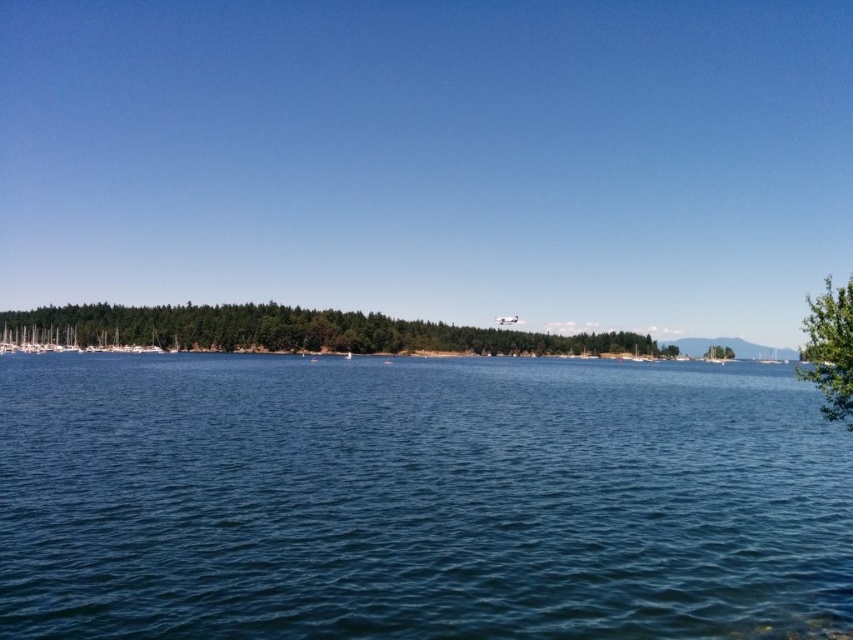
Locate an element on the screen. blue water at center is located at coordinates (416, 499).

Is blue water at center taller than green leafy tree at center-right?

Correct, blue water at center is much taller as green leafy tree at center-right.

I want to click on blue water at center, so click(x=416, y=499).

Which is below, blue water at center or green leafy trees at center?

Positioned lower is blue water at center.

Based on the photo, is blue water at center below green leafy trees at center?

Yes.

Is point (280, 365) closer to viewer compared to point (163, 323)?

That is True.

Locate an element on the screen. blue water at center is located at coordinates (416, 499).

Who is more forward, (846, 308) or (706, 352)?

Point (846, 308) is more forward.

The image size is (853, 640). In order to click on green leafy tree at right in this screenshot , I will do `click(830, 349)`.